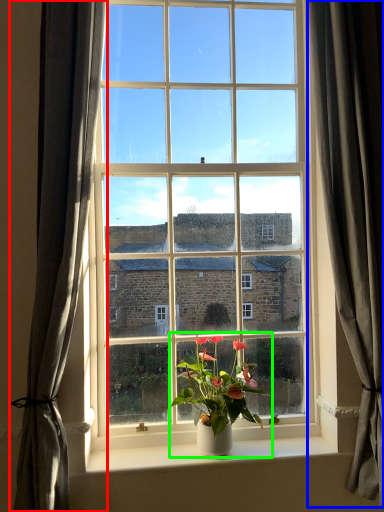
Question: Which object is the closest to the curtain (highlighted by a red box)? Choose among these: curtain (highlighted by a blue box) or houseplant (highlighted by a green box).

Choices:
 (A) curtain
 (B) houseplant

Answer: (B)